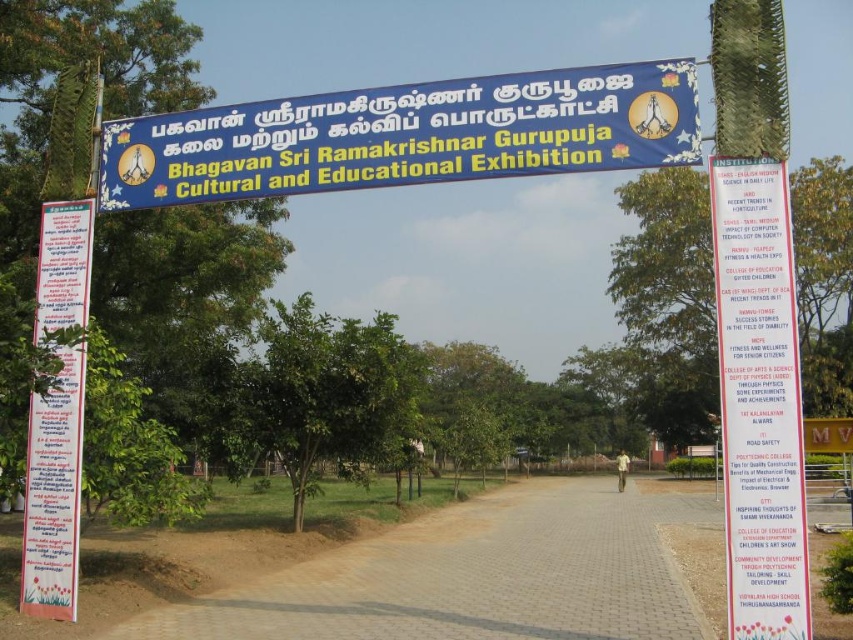
You are standing at the entrance of the exhibition and want to take a photo of the two points mentioned. Which point is closer to you, point (612,605) or point (102,129)?

Point (102,129) is closer to you because the description states that point (612,605) is further away from the viewer than point (102,129).

What is the 2D coordinate of the blue fabric banner at upper center in the image?

The blue fabric banner at upper center is located at the 2D coordinate point of (405, 134).

You are standing at the entrance of the exhibition and want to walk towards the blue fabric banner at upper center. Which direction should you move relative to the brown brick path at center?

To reach the blue fabric banner at upper center, you should move towards it from the brown brick path at center since the brown brick path at center is in front of the blue fabric banner at upper center.